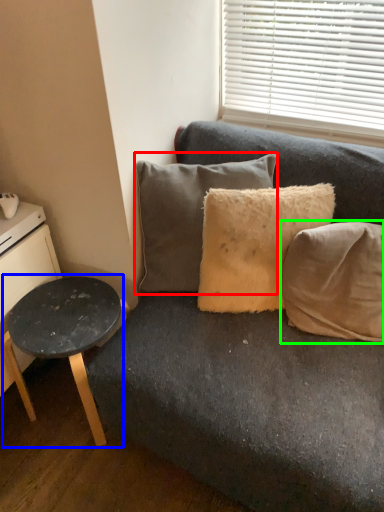
Question: Estimate the real-world distances between objects in this image. Which object is closer to pillow (highlighted by a red box), table (highlighted by a blue box) or pillow (highlighted by a green box)?

Choices:
 (A) table
 (B) pillow

Answer: (A)